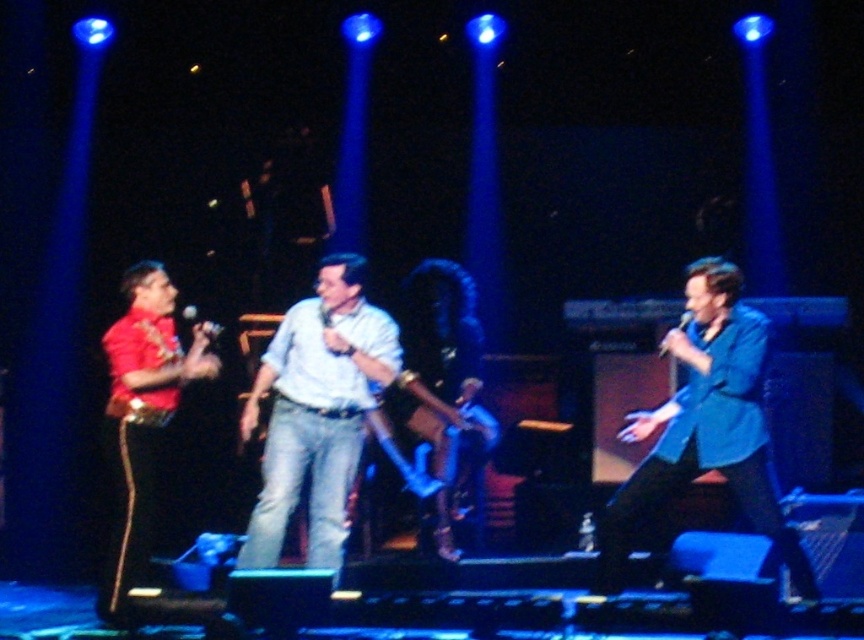
Question: Which object is positioned closest to the matte black microphone at center?

Choices:
 (A) shiny red jacket at left
 (B) blue glossy suit at center
 (C) black matte microphone at right

Answer: (A)

Question: Which point appears farthest from the camera in this image?

Choices:
 (A) (664, 348)
 (B) (213, 330)

Answer: (B)

Question: Can you confirm if shiny red jacket at left is positioned to the right of black matte microphone at right?

Choices:
 (A) yes
 (B) no

Answer: (B)

Question: Does blue glossy suit at center appear over black matte microphone at right?

Choices:
 (A) no
 (B) yes

Answer: (A)

Question: Which point is closer to the camera taking this photo?

Choices:
 (A) (674, 429)
 (B) (689, 316)
 (C) (210, 324)
 (D) (119, 458)

Answer: (A)

Question: Is shiny red jacket at left thinner than black matte microphone at right?

Choices:
 (A) yes
 (B) no

Answer: (B)